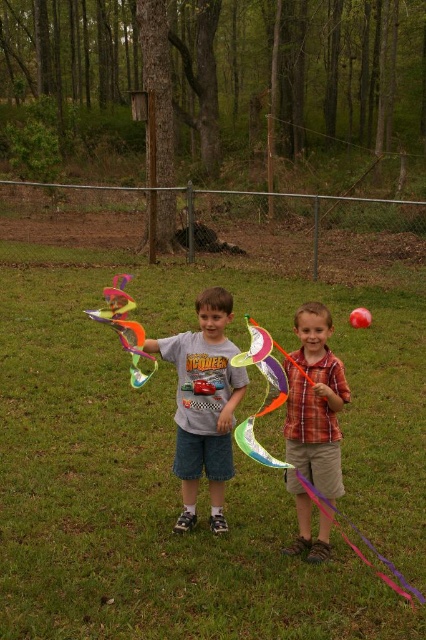
Can you confirm if gray cotton t-shirt at center is positioned to the right of plaid cotton shirt at center?

No, gray cotton t-shirt at center is not to the right of plaid cotton shirt at center.

Who is more distant from viewer, (207, 451) or (302, 468)?

Positioned behind is point (207, 451).

This screenshot has width=426, height=640. I want to click on gray cotton t-shirt at center, so 204,404.

Is plaid cotton shirt at center further to camera compared to rainbow plastic kite at center?

Yes.

Does point (296, 497) come closer to viewer compared to point (262, 456)?

No, (296, 497) is behind (262, 456).

The width and height of the screenshot is (426, 640). I want to click on plaid cotton shirt at center, so click(313, 424).

Who is taller, plaid cotton shirt at center or translucent plastic kite at center?

plaid cotton shirt at center is taller.

Consider the image. Is plaid cotton shirt at center above translucent plastic kite at center?

No, plaid cotton shirt at center is not above translucent plastic kite at center.

Between point (319, 474) and point (118, 275), which one is positioned in front?

Positioned in front is point (319, 474).

The height and width of the screenshot is (640, 426). Identify the location of plaid cotton shirt at center. (313, 424).